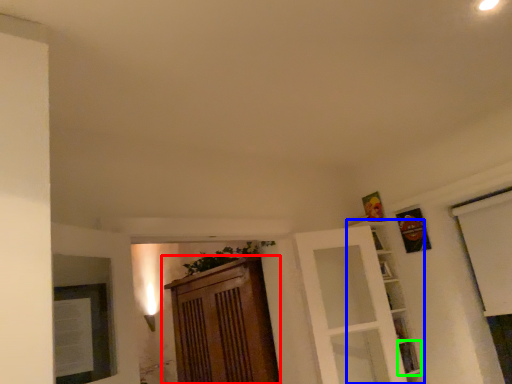
Question: Considering the real-world distances, which object is closest to cabinetry (highlighted by a red box)? shelf (highlighted by a blue box) or shelf (highlighted by a green box).

Choices:
 (A) shelf
 (B) shelf

Answer: (A)